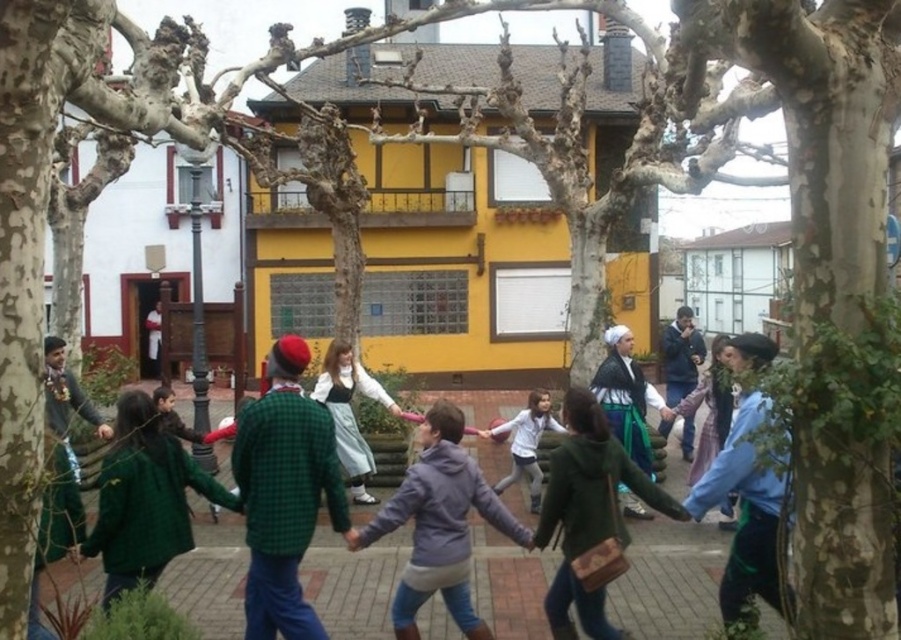
Question: Among these points, which one is farthest from the camera?

Choices:
 (A) (405, 612)
 (B) (180, 512)
 (C) (244, 602)
 (D) (560, 602)

Answer: (B)

Question: Is green fabric dress at center thinner than blue-green fabric skirt at center?

Choices:
 (A) yes
 (B) no

Answer: (B)

Question: Among these points, which one is farthest from the camera?

Choices:
 (A) (554, 509)
 (B) (687, 451)

Answer: (B)

Question: Based on their relative distances, which object is farther from the green wool sweater at center?

Choices:
 (A) matte green dress at center
 (B) blue-green fabric skirt at center

Answer: (B)

Question: Where is blue-green fabric skirt at center located in relation to green woolen dress at center in the image?

Choices:
 (A) right
 (B) left

Answer: (B)

Question: Is green wool sweater at center in front of blue denim jacket at center?

Choices:
 (A) yes
 (B) no

Answer: (A)